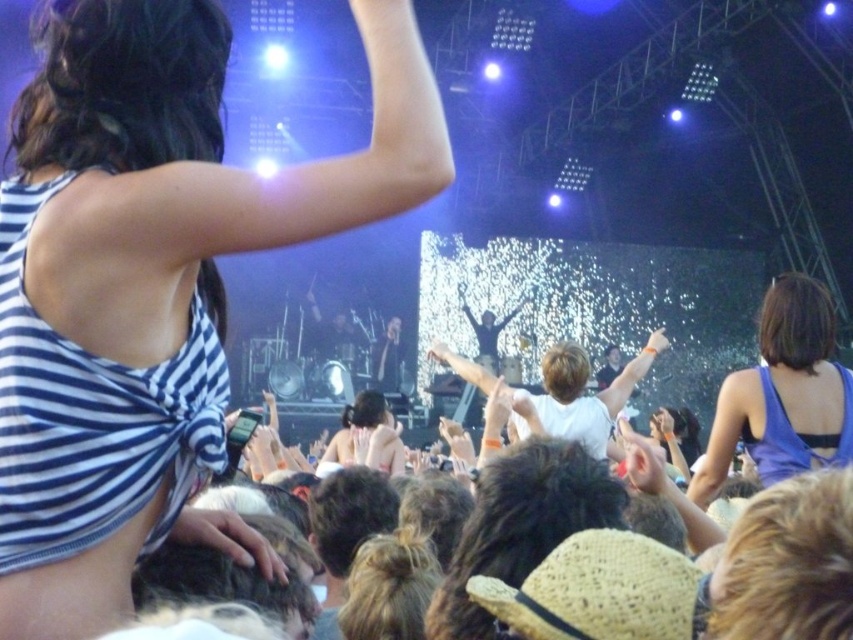
Is striped fabric tank top at upper left to the left of blue satin dress at upper right from the viewer's perspective?

Indeed, striped fabric tank top at upper left is positioned on the left side of blue satin dress at upper right.

Is striped fabric tank top at upper left shorter than blue satin dress at upper right?

Incorrect, striped fabric tank top at upper left's height does not fall short of blue satin dress at upper right's.

Does point (55, 118) come farther from viewer compared to point (825, 426)?

No, it is not.

Where is `striped fabric tank top at upper left`? The height and width of the screenshot is (640, 853). striped fabric tank top at upper left is located at coordinates (152, 285).